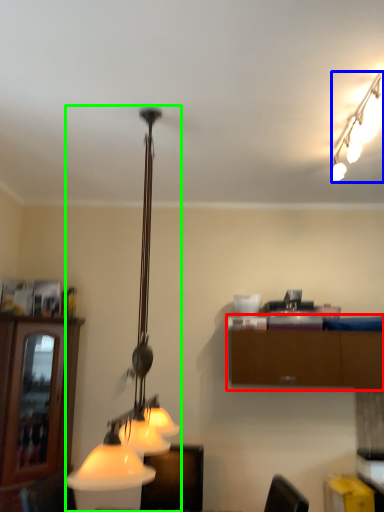
Question: Considering the real-world distances, which object is farthest from cabinetry (highlighted by a red box)? lamp (highlighted by a blue box) or lamp (highlighted by a green box)?

Choices:
 (A) lamp
 (B) lamp

Answer: (A)